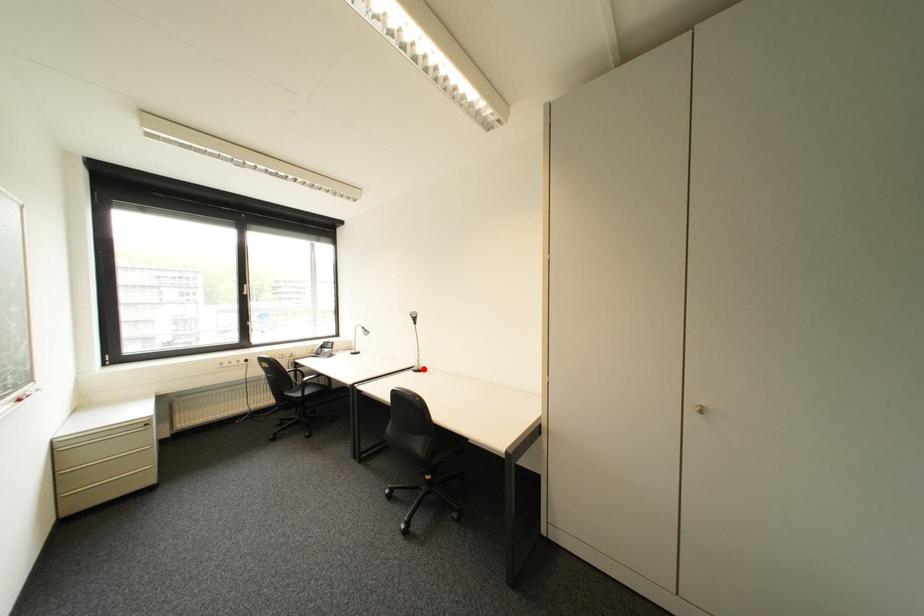
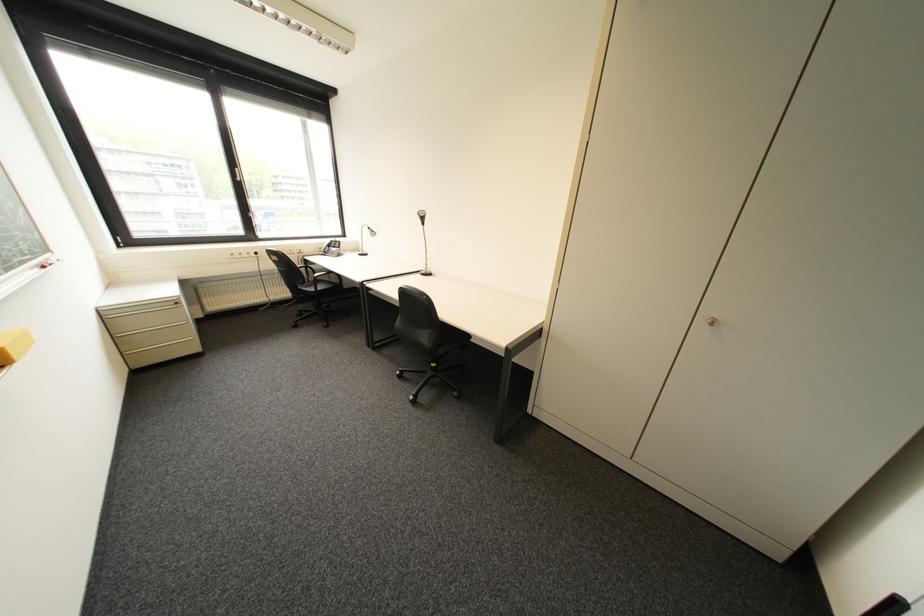
Locate, in the second image, the point that corresponds to the highlighted location in the first image.

(432, 273)